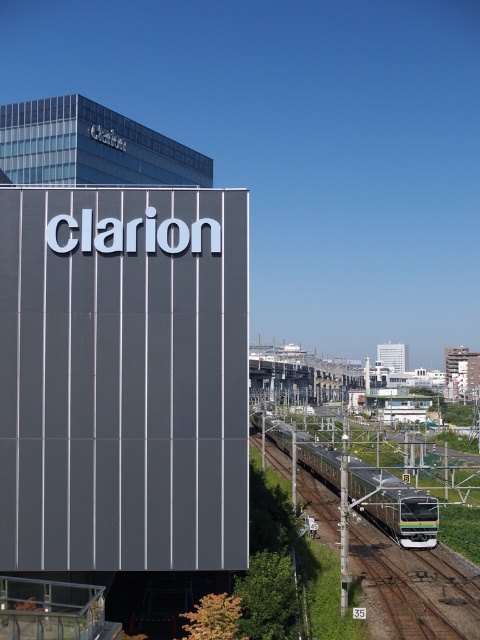
You are standing at the entrance of the Clarion building and want to find the green metallic train track at lower center. According to the map coordinates, where should you look to locate it?

The green metallic train track at lower center is located at coordinates point (414,588).

From the picture: You are standing at the railway track in the image and want to reach a specific point marked at coordinates point [465,620]. If your walking speed is 1.5 meters per second, how many seconds will it take you to reach that point?

The distance of point [465,620] from viewer is 32.99 meters. At a walking speed of 1.5 meters per second, it will take approximately 22 seconds to reach the point since 32.99 divided by 1.5 equals approximately 22 seconds.